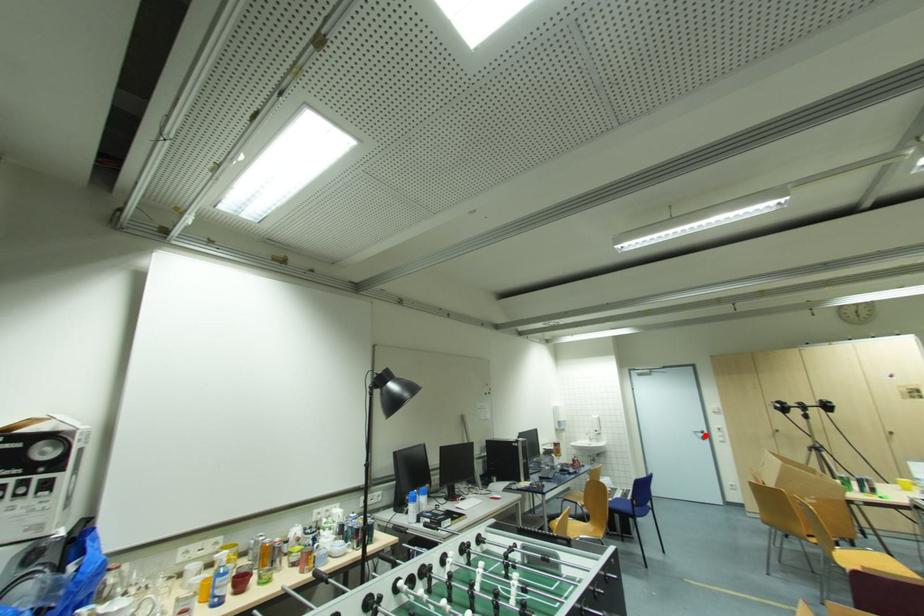
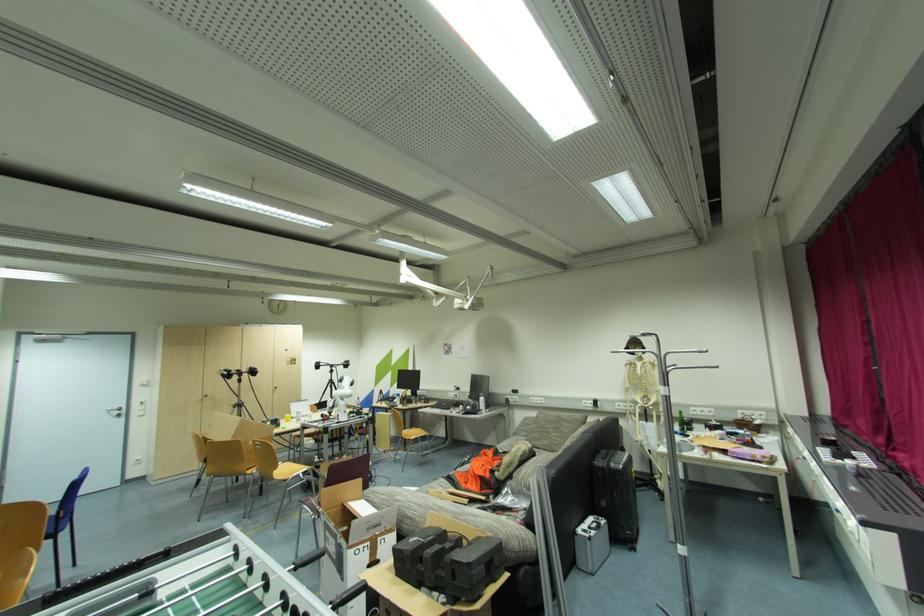
Find the pixel in the second image that matches the highlighted location in the first image.

(122, 413)